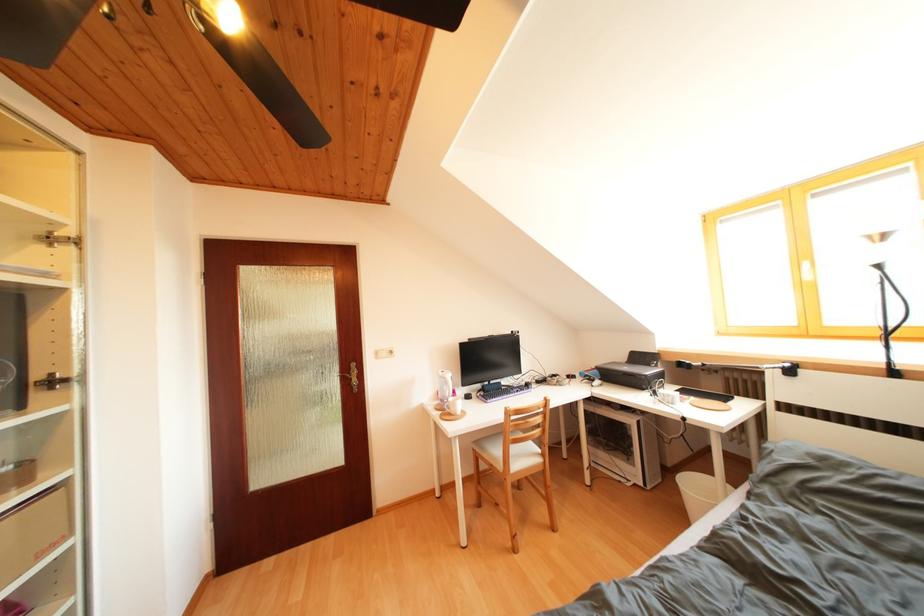
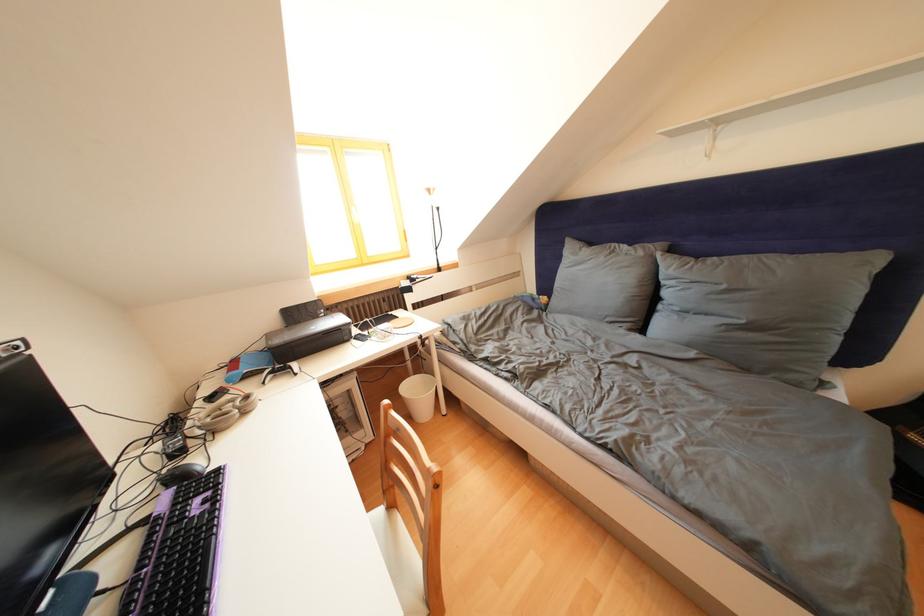
Where in the second image is the point corresponding to [577,382] from the first image?

(220, 403)